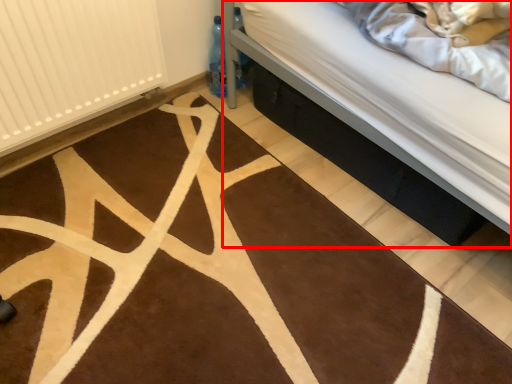
Question: Observing the image, what is the correct spatial positioning of bed (annotated by the red box) in reference to radiator?

Choices:
 (A) right
 (B) left

Answer: (A)